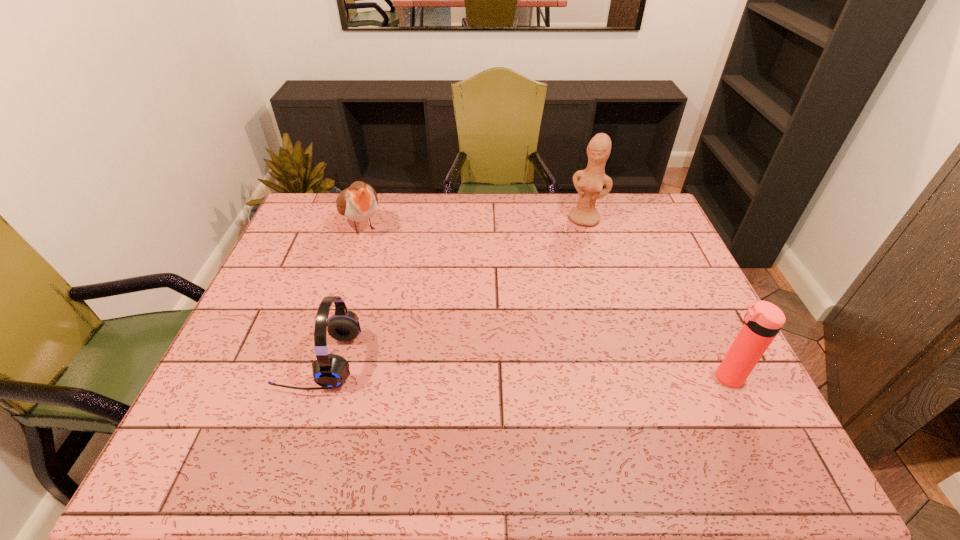
This screenshot has width=960, height=540. I want to click on the closest object to the bird, so click(330, 371).

Identify which object is the third closest to the rightmost object. Please provide its 2D coordinates. Your answer should be formatted as a tuple, i.e. [(x, y)], where the tuple contains the x and y coordinates of a point satisfying the conditions above.

[(358, 203)]